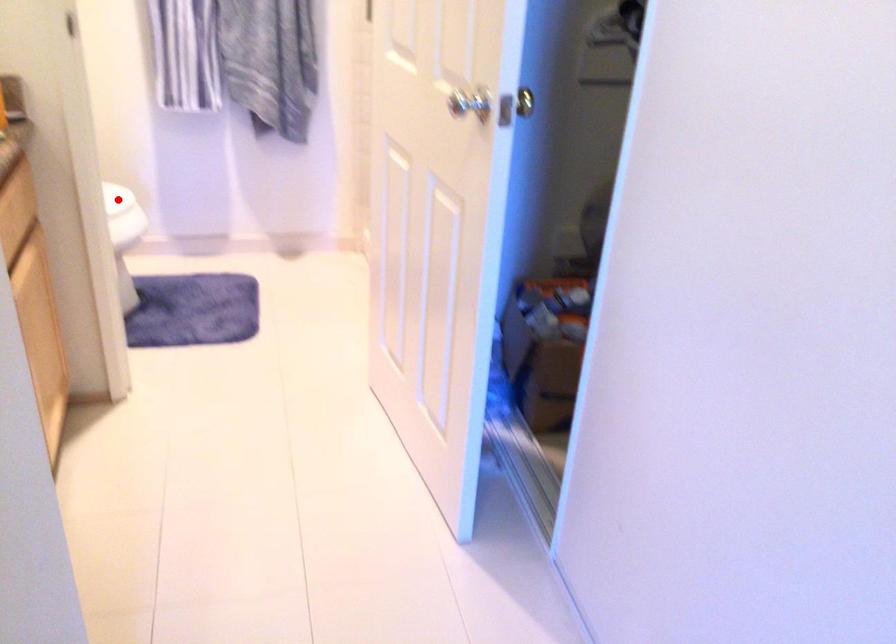
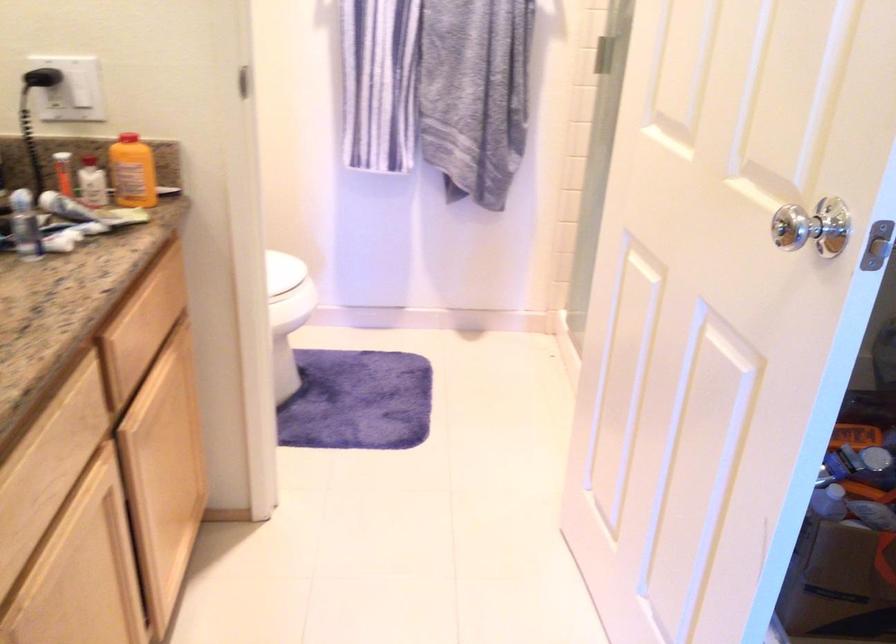
Question: I am providing you with two images of the same scene from different viewpoints. In image1, a red point is highlighted. Considering the same 3D point in image2, which of the following is correct?

Choices:
 (A) It is closer
 (B) It is farther

Answer: (A)